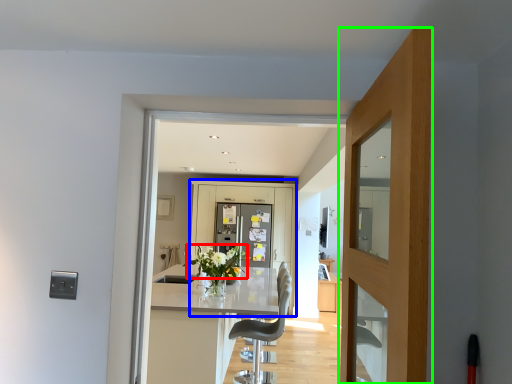
Question: Considering the real-world distances, which object is closest to flower (highlighted by a red box)? barn door (highlighted by a blue box) or door (highlighted by a green box).

Choices:
 (A) barn door
 (B) door

Answer: (A)